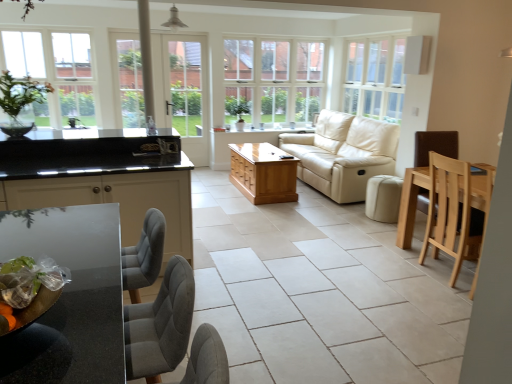
Where is `black glossy countertop at center`? Image resolution: width=512 pixels, height=384 pixels. black glossy countertop at center is located at coordinates (94, 134).

Measure the distance between white glass screen door at center and camera.

white glass screen door at center and camera are 5.46 meters apart.

What is the approximate width of white wood window at upper right, the 1th window in the right-to-left sequence?

The width of white wood window at upper right, the 1th window in the right-to-left sequence, is 8.97 inches.

Find the location of a particular element. The width and height of the screenshot is (512, 384). beige leather couch at center is located at coordinates pyautogui.click(x=343, y=154).

What do you see at coordinates (263, 173) in the screenshot? I see `light brown wooden coffee table at center` at bounding box center [263, 173].

This screenshot has height=384, width=512. I want to click on black glossy countertop at center, so click(94, 134).

Identify the location of chair in front of the green glass vase at upper left. (453, 212).

Looking at their sizes, would you say natural wood chair at right is wider or thinner than green glass vase at upper left?

Clearly, natural wood chair at right has more width compared to green glass vase at upper left.

Does point (438, 201) appear closer or farther from the camera than point (50, 89)?

Clearly, point (438, 201) is closer to the camera than point (50, 89).

How different are the orientations of natural wood chair at right and green glass vase at upper left in degrees?

The angular difference between natural wood chair at right and green glass vase at upper left is 87.3 degrees.

The image size is (512, 384). Find the location of `cabinetry to the left of white glass screen door at center`. cabinetry to the left of white glass screen door at center is located at coordinates (119, 196).

Is white glass screen door at center placed right next to black glossy cabinet at left?

No, white glass screen door at center is not with black glossy cabinet at left.

Is white glass screen door at center to the left of black glossy cabinet at left from the viewer's perspective?

No.

In the scene shown: Can you confirm if white glass screen door at center is taller than black glossy cabinet at left?

Yes.

Identify the location of the 1st window behind the natural wood chair at right, starting your count from the anchor. (375, 78).

In the scene shown: Is natural wood chair at right turned away from white wood window at upper right, the 1th window in the right-to-left sequence?

That's not correct — natural wood chair at right is not looking away from white wood window at upper right, the 1th window in the right-to-left sequence.

Consider the image. Who is smaller, natural wood chair at right or white wood window at upper right, which appears as the third window when viewed from the left?

white wood window at upper right, which appears as the third window when viewed from the left.

Locate an element on the screen. This screenshot has height=384, width=512. chair that appears in front of the clear glass window at upper left, the third window from the right is located at coordinates (453, 212).

Does natural wood chair at right lie behind clear glass window at upper left, the third window from the right?

No, natural wood chair at right is in front of clear glass window at upper left, the third window from the right.

Could you tell me if natural wood chair at right is turned towards clear glass window at upper left, the third window from the right?

No, natural wood chair at right is not facing towards clear glass window at upper left, the third window from the right.

Looking at this image, which of these two, natural wood chair at right or clear glass window at upper left, the first window viewed from the left, is wider?

With larger width is natural wood chair at right.

Is clear glass window at upper left, the third window from the right, oriented away from beige leather ottoman at center?

No, clear glass window at upper left, the third window from the right,'s orientation is not away from beige leather ottoman at center.

Is clear glass window at upper left, the first window viewed from the left, beside beige leather ottoman at center?

No, clear glass window at upper left, the first window viewed from the left, is not touching beige leather ottoman at center.

Would you say clear glass window at upper left, the first window viewed from the left, contains beige leather ottoman at center?

Definitely not — beige leather ottoman at center is not inside clear glass window at upper left, the first window viewed from the left.

Where is `bar stool on the right of clear glass window at upper left, the first window viewed from the left`? The width and height of the screenshot is (512, 384). bar stool on the right of clear glass window at upper left, the first window viewed from the left is located at coordinates (383, 198).

From the picture: Could you measure the distance between white wood window at upper right, the 1th window in the right-to-left sequence, and black glossy cabinet at left?

The distance of white wood window at upper right, the 1th window in the right-to-left sequence, from black glossy cabinet at left is 3.56 meters.

Which of these two, white wood window at upper right, the 1th window in the right-to-left sequence, or black glossy cabinet at left, is smaller?

white wood window at upper right, the 1th window in the right-to-left sequence.

From the image's perspective, is white wood window at upper right, the 1th window in the right-to-left sequence, positioned above or below black glossy cabinet at left?

white wood window at upper right, the 1th window in the right-to-left sequence, is above black glossy cabinet at left.

What's the angular difference between white wood window at upper right, the 1th window in the right-to-left sequence, and black glossy cabinet at left's facing directions?

90.3 degrees.

Considering the points (33, 63) and (379, 167), which point is in front, point (33, 63) or point (379, 167)?

The point (379, 167) is closer.

Locate an element on the screen. The image size is (512, 384). studio couch that is in front of the clear glass window at upper left, the first window viewed from the left is located at coordinates (343, 154).

Based on the photo, are clear glass window at upper left, the first window viewed from the left, and beige leather couch at center beside each other?

No, clear glass window at upper left, the first window viewed from the left, is not next to beige leather couch at center.

Who is taller, clear glass window at upper left, the first window viewed from the left, or beige leather couch at center?

clear glass window at upper left, the first window viewed from the left.

The image size is (512, 384). What are the coordinates of `plant on the left of natural wood chair at right` in the screenshot? It's located at (20, 93).

This screenshot has width=512, height=384. I want to click on screen door on the right side of black glossy cabinet at left, so click(187, 93).

Considering their positions, is black glossy cabinet at left positioned closer to beige leather ottoman at center than white glass screen door at center?

Based on the image, black glossy cabinet at left appears to be nearer to beige leather ottoman at center.

From the image, which object appears to be farther from light brown wooden coffee table at center, natural wood chair at right or green glass vase at upper left?

Based on the image, green glass vase at upper left appears to be further to light brown wooden coffee table at center.

Looking at the image, which one is located further to beige leather ottoman at center, black glossy cabinet at left or white glass window at center, the second window viewed from the right?

The object further to beige leather ottoman at center is black glossy cabinet at left.

Considering their positions, is natural wood chair at right positioned further to black glossy cabinet at left than clear glass window at upper left, the third window from the right?

Among the two, clear glass window at upper left, the third window from the right, is located further to black glossy cabinet at left.

Estimate the real-world distances between objects in this image. Which object is further from white glass screen door at center, clear glass window at upper left, the first window viewed from the left, or green glass vase at upper left?

Among the two, green glass vase at upper left is located further to white glass screen door at center.

Based on their spatial positions, is white glass screen door at center or natural wood chair at right closer to beige leather couch at center?

white glass screen door at center.

Based on their spatial positions, is black glossy cabinet at left or light brown wooden coffee table at center further from white glass screen door at center?

black glossy cabinet at left.

Looking at the image, which one is located closer to black glossy countertop at center, white wood window at upper right, the 1th window in the right-to-left sequence, or beige leather ottoman at center?

white wood window at upper right, the 1th window in the right-to-left sequence, is positioned closer to the anchor black glossy countertop at center.

Locate an element on the screen. This screenshot has width=512, height=384. studio couch between clear glass window at upper left, the first window viewed from the left, and beige leather ottoman at center, in the horizontal direction is located at coordinates (343, 154).

Identify the location of studio couch positioned between black glossy cabinet at left and white glass screen door at center from near to far. This screenshot has height=384, width=512. [343, 154].

I want to click on table between black glossy cabinet at left and white glass window at center, the second window viewed from the right, from front to back, so click(263, 173).

Locate an element on the screen. This screenshot has height=384, width=512. cabinetry situated between clear glass window at upper left, the first window viewed from the left, and beige leather couch at center from left to right is located at coordinates (119, 196).